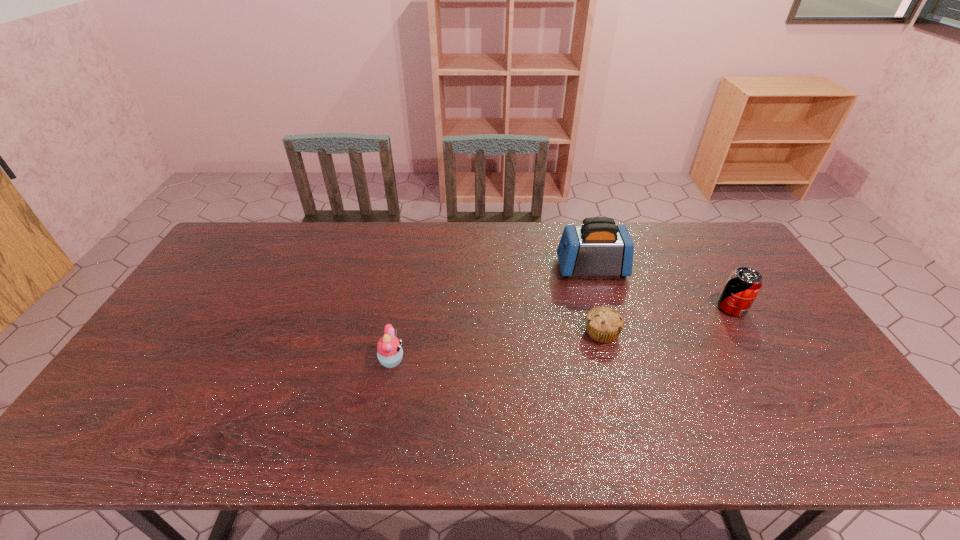
This screenshot has height=540, width=960. What are the coordinates of `free location located 0.090m on the right of the soda can` in the screenshot? It's located at (776, 308).

What are the coordinates of `vacant space located on the face of the cupcake` in the screenshot? It's located at (468, 361).

Locate an element on the screen. The image size is (960, 540). vacant area located on the left of the muffin is located at coordinates (449, 333).

This screenshot has height=540, width=960. I want to click on object that is at the far edge, so click(x=598, y=247).

At what (x,y) coordinates should I click in order to perform the action: click on object that is at the right edge. Please return your answer as a coordinate pair (x, y). Image resolution: width=960 pixels, height=540 pixels. Looking at the image, I should click on (743, 285).

The height and width of the screenshot is (540, 960). I want to click on vacant region at the far edge of the desktop, so click(367, 224).

The image size is (960, 540). What are the coordinates of `free location at the near edge of the desktop` in the screenshot? It's located at (743, 421).

Image resolution: width=960 pixels, height=540 pixels. In the image, there is a desktop. In order to click on vacant space at the left edge in this screenshot , I will do `click(194, 334)`.

Locate an element on the screen. This screenshot has width=960, height=540. free space at the right edge of the desktop is located at coordinates (785, 338).

The height and width of the screenshot is (540, 960). I want to click on free space at the far right corner of the desktop, so click(x=729, y=231).